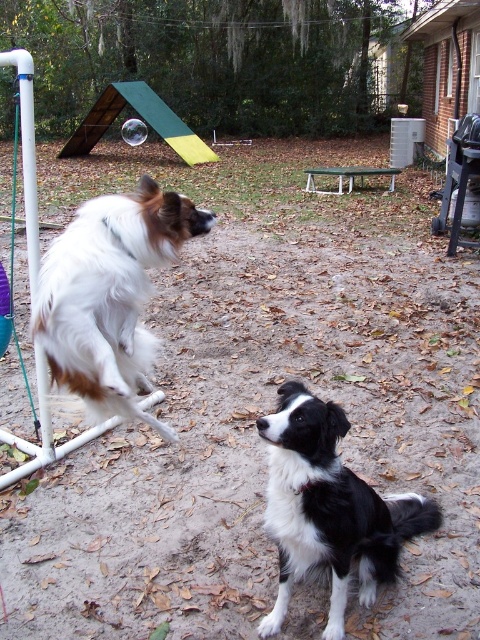
From the picture: Who is positioned more to the right, white and brown fur dog at left or black and white fur at center?

Positioned to the right is black and white fur at center.

This screenshot has width=480, height=640. Find the location of `white and brown fur dog at left`. white and brown fur dog at left is located at coordinates (109, 294).

This screenshot has height=640, width=480. I want to click on white and brown fur dog at left, so click(109, 294).